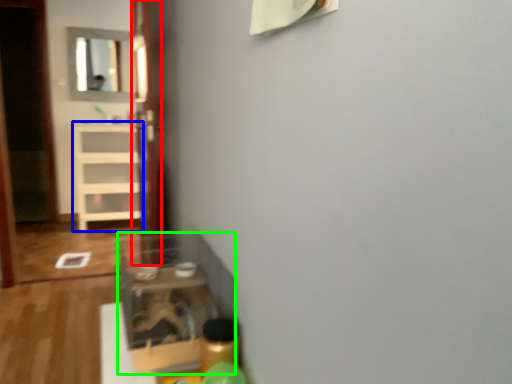
Question: Which object is positioned farthest from glass door (highlighted by a red box)? Select from shelf (highlighted by a blue box) and shelf (highlighted by a green box).

Choices:
 (A) shelf
 (B) shelf

Answer: (A)